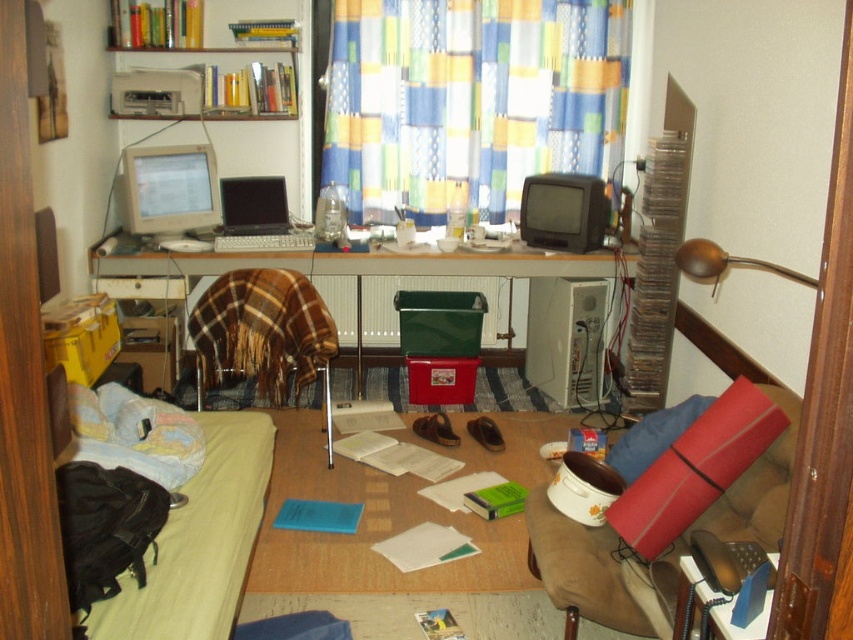
Question: Where is matte plastic computer desk at center located in relation to red fabric chair at lower right in the image?

Choices:
 (A) left
 (B) right

Answer: (A)

Question: Which point is closer to the camera?

Choices:
 (A) (141, 202)
 (B) (762, 628)
 (C) (236, 573)
 (D) (463, 422)

Answer: (B)

Question: Considering the real-world distances, which object is closest to the red fabric chair at lower right?

Choices:
 (A) white plastic printer at upper left
 (B) white plastic desktop computer at center

Answer: (B)

Question: Is red fabric chair at lower right to the left of white plastic printer at upper left from the viewer's perspective?

Choices:
 (A) no
 (B) yes

Answer: (A)

Question: Does white plastic desktop computer at center have a larger size compared to matte plastic phone at lower right?

Choices:
 (A) no
 (B) yes

Answer: (B)

Question: Which point is farther to the camera?

Choices:
 (A) white plastic printer at upper left
 (B) matte black monitor at center
 (C) wooden table at center

Answer: (A)